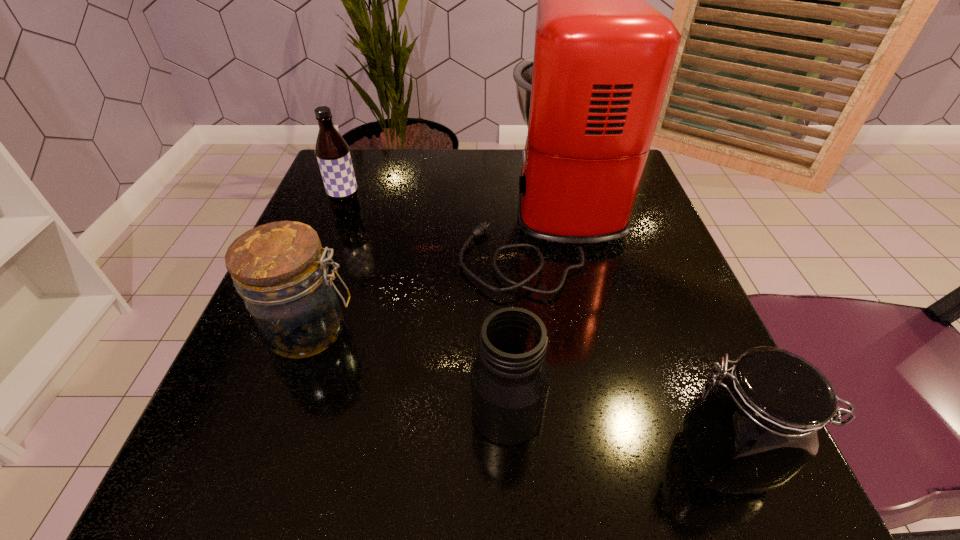
This screenshot has height=540, width=960. In order to click on the tallest object in this screenshot , I will do tap(591, 96).

Find the location of a particular element. The height and width of the screenshot is (540, 960). the second tallest object is located at coordinates (332, 152).

At what (x,y) coordinates should I click in order to perform the action: click on the leftmost jar. Please return your answer as a coordinate pair (x, y). The image size is (960, 540). Looking at the image, I should click on (280, 270).

Locate an element on the screen. This screenshot has width=960, height=540. the farthest jar is located at coordinates (280, 270).

Image resolution: width=960 pixels, height=540 pixels. What are the coordinates of `the second jar from left to right` in the screenshot? It's located at (510, 378).

Find the location of a particular element. The width and height of the screenshot is (960, 540). the rightmost jar is located at coordinates (752, 430).

Where is `free spot located 0.270m on the front-facing side of the tallest object`? free spot located 0.270m on the front-facing side of the tallest object is located at coordinates pyautogui.click(x=329, y=210).

Where is `vacant area located on the front-facing side of the tallest object`? The width and height of the screenshot is (960, 540). vacant area located on the front-facing side of the tallest object is located at coordinates (388, 210).

You are a GUI agent. You are given a task and a screenshot of the screen. Output one action in this format:
    pyautogui.click(x=<x>, y=<y>)
    Task: Click on the free space located on the front-facing side of the tallest object
    The image size is (960, 540).
    Given the screenshot: What is the action you would take?
    pyautogui.click(x=403, y=210)

I want to click on vacant space located 0.070m on the front of the fourth shortest object, so click(337, 248).